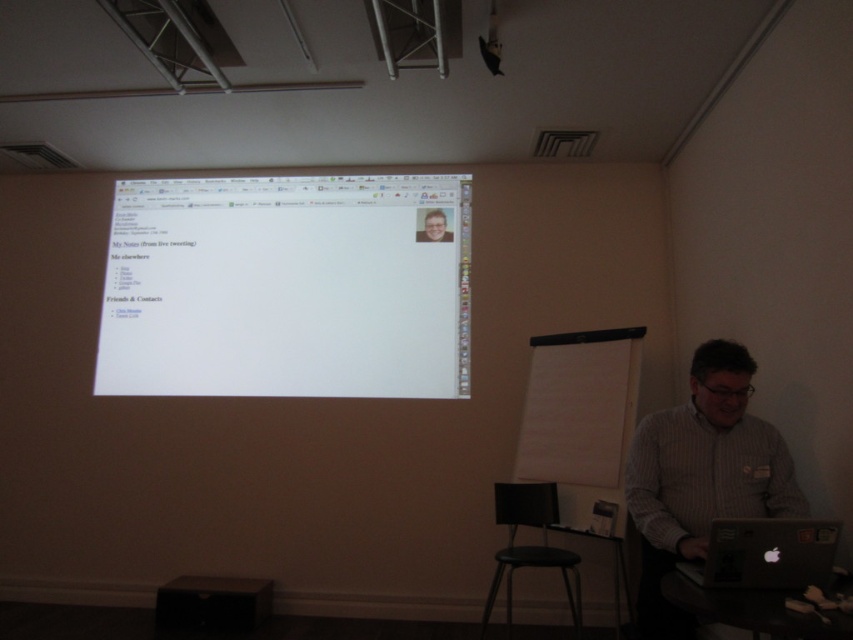
Does silver metallic laptop at lower right appear on the right side of black plastic stool at lower center?

Indeed, silver metallic laptop at lower right is positioned on the right side of black plastic stool at lower center.

Which is behind, point (735, 561) or point (564, 550)?

Positioned behind is point (564, 550).

Which is behind, point (732, 561) or point (573, 625)?

The point (573, 625) is more distant.

Where is `silver metallic laptop at lower right`? This screenshot has width=853, height=640. silver metallic laptop at lower right is located at coordinates (764, 554).

Between point (688, 428) and point (567, 577), which one is positioned behind?

Point (567, 577)

Does white shirt at lower right appear on the right side of black plastic stool at lower center?

Yes, white shirt at lower right is to the right of black plastic stool at lower center.

What do you see at coordinates (701, 476) in the screenshot?
I see `white shirt at lower right` at bounding box center [701, 476].

Identify the location of white shirt at lower right. (701, 476).

Looking at this image, can you confirm if white glossy screen at upper center is thinner than light brown wooden desk at center?

No.

Image resolution: width=853 pixels, height=640 pixels. I want to click on white glossy screen at upper center, so click(286, 288).